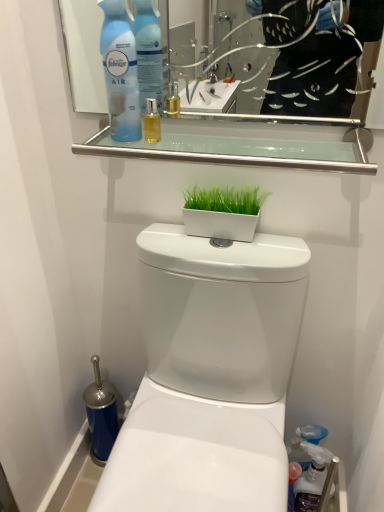
You are a GUI agent. You are given a task and a screenshot of the screen. Output one action in this format:
    pyautogui.click(x=<x>, y=<y>)
    Task: Click on the free space that is to the left of white glossy flowerpot at center
    Image resolution: width=384 pixels, height=512 pixels.
    Given the screenshot: What is the action you would take?
    pyautogui.click(x=176, y=239)